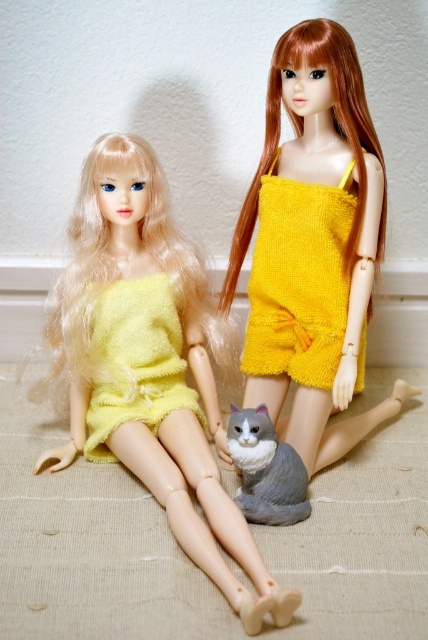
Question: Observing the image, what is the correct spatial positioning of yellow fuzzy dress at center in reference to gray plush cat at lower center?

Choices:
 (A) right
 (B) left

Answer: (A)

Question: Is matte yellow fabric dress at left positioned behind matte yellow sweater at left?

Choices:
 (A) yes
 (B) no

Answer: (B)

Question: Which point is farther from the camera taking this photo?

Choices:
 (A) (288, 304)
 (B) (174, 234)
 (C) (240, 476)
 (D) (287, 262)

Answer: (B)

Question: Considering the real-world distances, which object is farthest from the matte yellow fabric dress at left?

Choices:
 (A) yellow knitted romper at center
 (B) gray plush cat at lower center

Answer: (A)

Question: Among these objects, which one is farthest from the camera?

Choices:
 (A) yellow knitted romper at center
 (B) gray plush cat at lower center
 (C) yellow fuzzy dress at center

Answer: (C)

Question: Can you confirm if matte yellow sweater at left is positioned below gray plush cat at lower center?

Choices:
 (A) yes
 (B) no

Answer: (B)